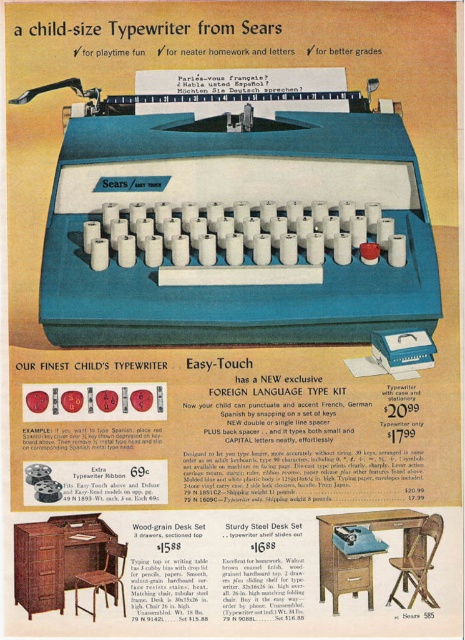
Does wood-grain desk set at lower left have a greater width compared to wood-grain desk set at center?

Yes, wood-grain desk set at lower left is wider than wood-grain desk set at center.

Is wood-grain desk set at lower left above wood-grain desk set at center?

No.

Between point (31, 582) and point (405, 586), which one is positioned behind?

Positioned behind is point (405, 586).

Image resolution: width=465 pixels, height=640 pixels. What are the coordinates of `wood-grain desk set at lower left` in the screenshot? It's located at (64, 561).